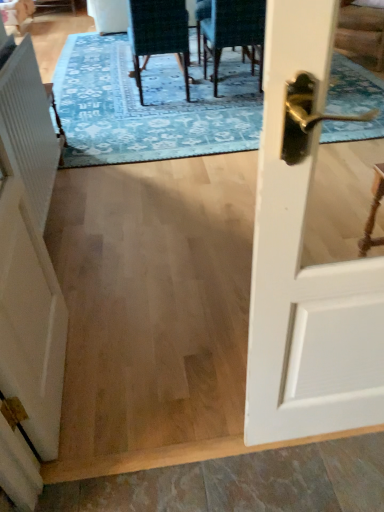
Identify the location of vacant area that is in front of velvet dark green chair at center, marked as the first chair in a left-to-right arrangement. Image resolution: width=384 pixels, height=512 pixels. (150, 121).